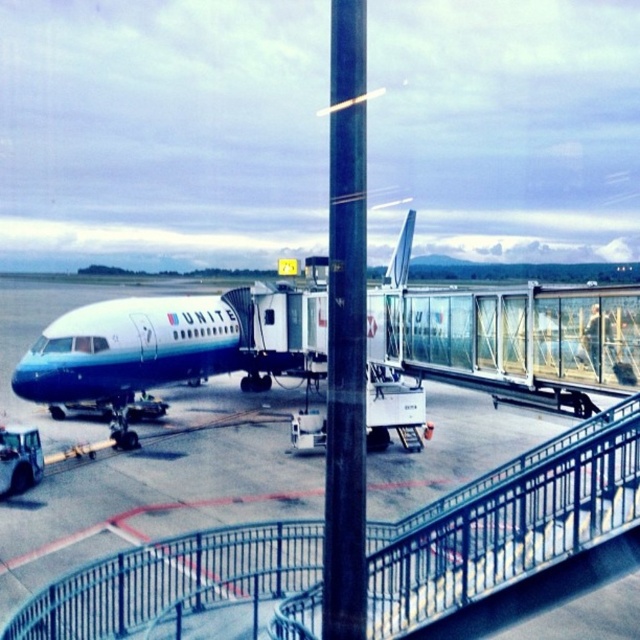
Question: Can you confirm if blue polished airplane at center is bigger than metallic pole at center?

Choices:
 (A) yes
 (B) no

Answer: (A)

Question: Which point is farther to the camera?

Choices:
 (A) (132, 348)
 (B) (362, 452)

Answer: (A)

Question: Which of the following is the farthest from the observer?

Choices:
 (A) metallic pole at center
 (B) blue polished airplane at center
 (C) blue glossy tarmac at center

Answer: (C)

Question: Which object appears farthest from the camera in this image?

Choices:
 (A) metallic pole at center
 (B) blue glossy tarmac at center
 (C) blue polished airplane at center

Answer: (B)

Question: Is blue glossy tarmac at center smaller than blue polished airplane at center?

Choices:
 (A) yes
 (B) no

Answer: (B)

Question: Can you confirm if blue glossy tarmac at center is smaller than metallic pole at center?

Choices:
 (A) no
 (B) yes

Answer: (A)